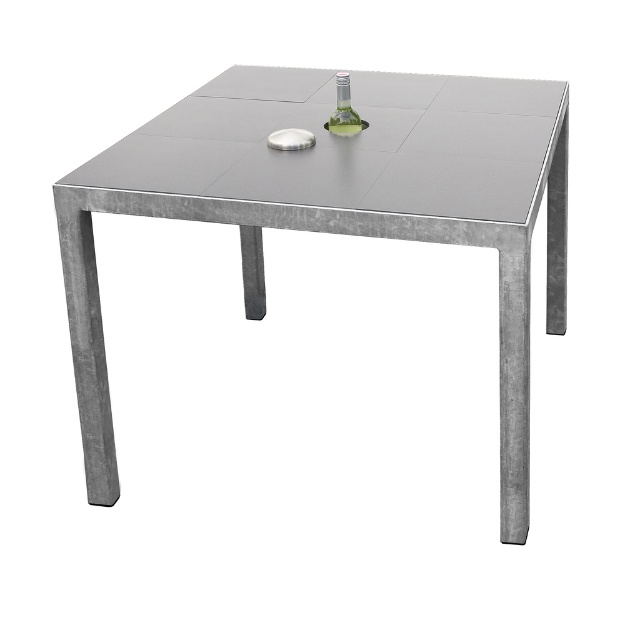
Who is taller, metallic gray table at center or transparent glass bottle at center?

With more height is metallic gray table at center.

Can you confirm if metallic gray table at center is thinner than transparent glass bottle at center?

In fact, metallic gray table at center might be wider than transparent glass bottle at center.

What do you see at coordinates (337, 208) in the screenshot?
I see `metallic gray table at center` at bounding box center [337, 208].

The image size is (640, 640). Identify the location of metallic gray table at center. (337, 208).